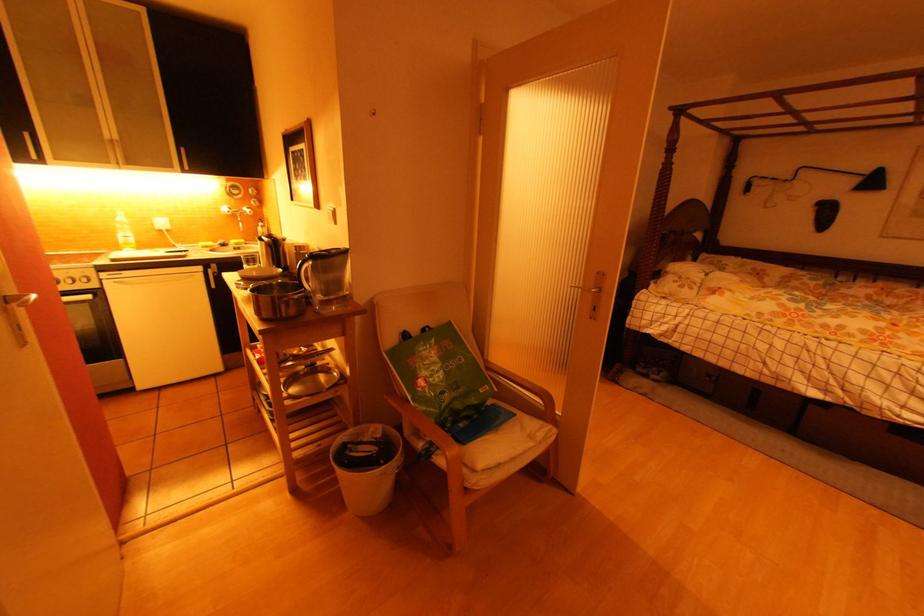
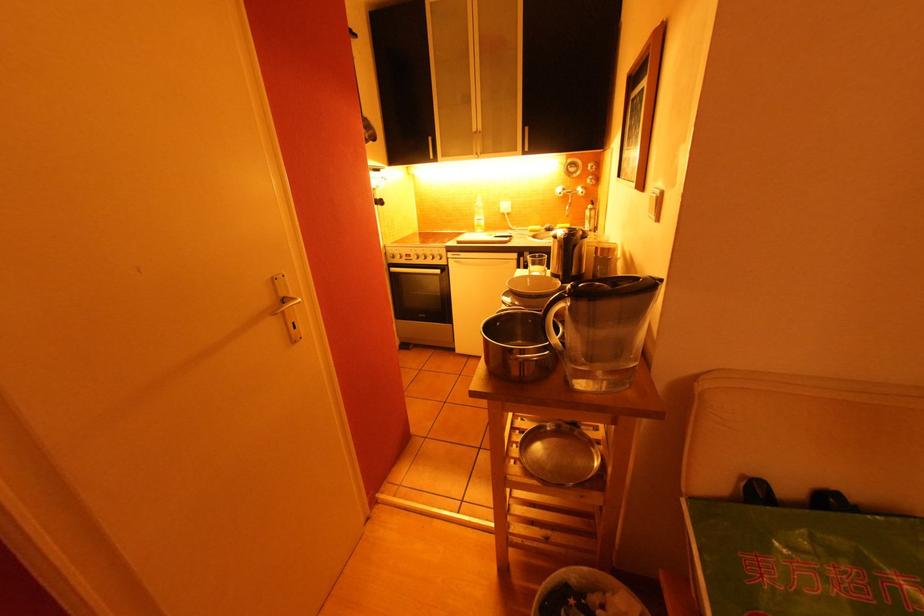
Where in the second image is the point corresponding to (290,387) from the first image?

(535, 440)